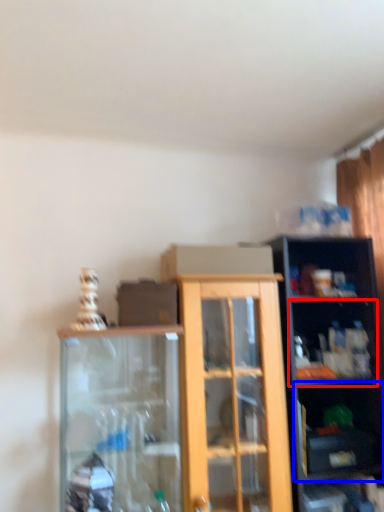
Question: Which of the following is the farthest to the observer, shelf (highlighted by a red box) or shelf (highlighted by a blue box)?

Choices:
 (A) shelf
 (B) shelf

Answer: (A)